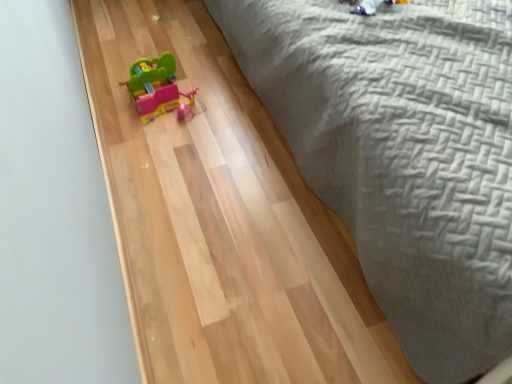
Question: Considering the relative sizes of matte plastic toy car at center and gray woven bedspread at upper right in the image provided, is matte plastic toy car at center bigger than gray woven bedspread at upper right?

Choices:
 (A) no
 (B) yes

Answer: (A)

Question: Is gray woven bedspread at upper right at the back of matte plastic toy car at center?

Choices:
 (A) no
 (B) yes

Answer: (A)

Question: Considering the relative sizes of matte plastic toy car at center and gray woven bedspread at upper right in the image provided, is matte plastic toy car at center thinner than gray woven bedspread at upper right?

Choices:
 (A) yes
 (B) no

Answer: (A)

Question: From a real-world perspective, is matte plastic toy car at center on gray woven bedspread at upper right?

Choices:
 (A) no
 (B) yes

Answer: (A)

Question: Is matte plastic toy car at center at the left side of gray woven bedspread at upper right?

Choices:
 (A) yes
 (B) no

Answer: (A)

Question: Is matte plastic toy car at center positioned behind gray woven bedspread at upper right?

Choices:
 (A) no
 (B) yes

Answer: (B)

Question: Does gray woven bedspread at upper right appear on the right side of matte plastic toy car at center?

Choices:
 (A) yes
 (B) no

Answer: (A)

Question: Could you tell me if gray woven bedspread at upper right is turned towards matte plastic toy car at center?

Choices:
 (A) no
 (B) yes

Answer: (A)

Question: Considering the relative sizes of gray woven bedspread at upper right and matte plastic toy car at center in the image provided, is gray woven bedspread at upper right thinner than matte plastic toy car at center?

Choices:
 (A) yes
 (B) no

Answer: (B)

Question: Can you see gray woven bedspread at upper right touching matte plastic toy car at center?

Choices:
 (A) no
 (B) yes

Answer: (A)

Question: Does gray woven bedspread at upper right have a greater width compared to matte plastic toy car at center?

Choices:
 (A) yes
 (B) no

Answer: (A)

Question: Is gray woven bedspread at upper right bigger than matte plastic toy car at center?

Choices:
 (A) yes
 (B) no

Answer: (A)

Question: From a real-world perspective, is matte plastic toy car at center above or below gray woven bedspread at upper right?

Choices:
 (A) below
 (B) above

Answer: (A)